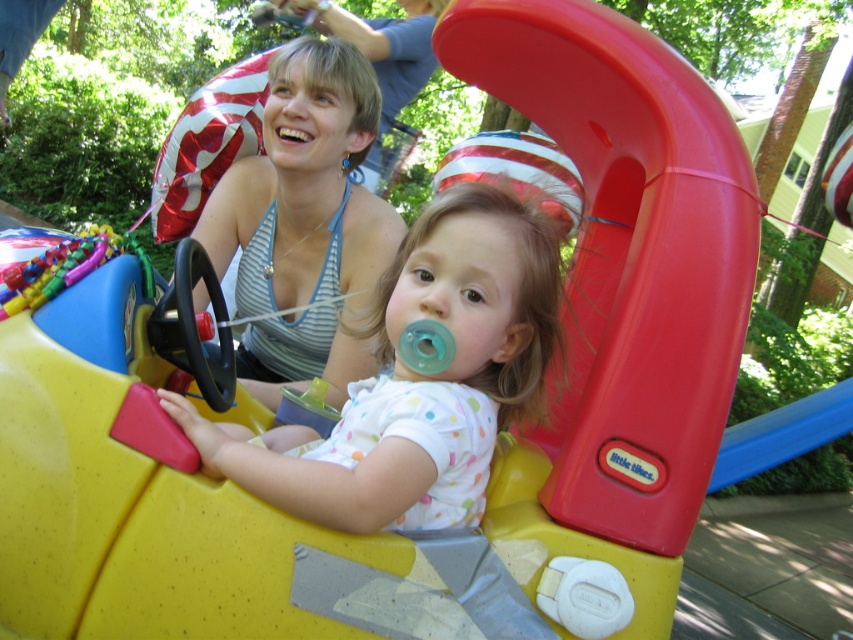
You are a photographer setting up for a family photo. You notice the white dotted fabric at center and the matte blue tank top at upper center in the scene. Which clothing item is shorter in length?

The white dotted fabric at center is shorter than the matte blue tank top at upper center.

You are a photographer trying to capture the perfect shot of the scene. You notice the white dotted fabric at center. Where exactly is this fabric positioned in the image?

The white dotted fabric at center is located at point (421, 380) in the image.

You are a photographer standing in front of the scene. You notice the white dotted fabric at center and the matte blue tank top at upper center. Which one is nearer to you?

The white dotted fabric at center is closer to the viewer than the matte blue tank top at upper center.